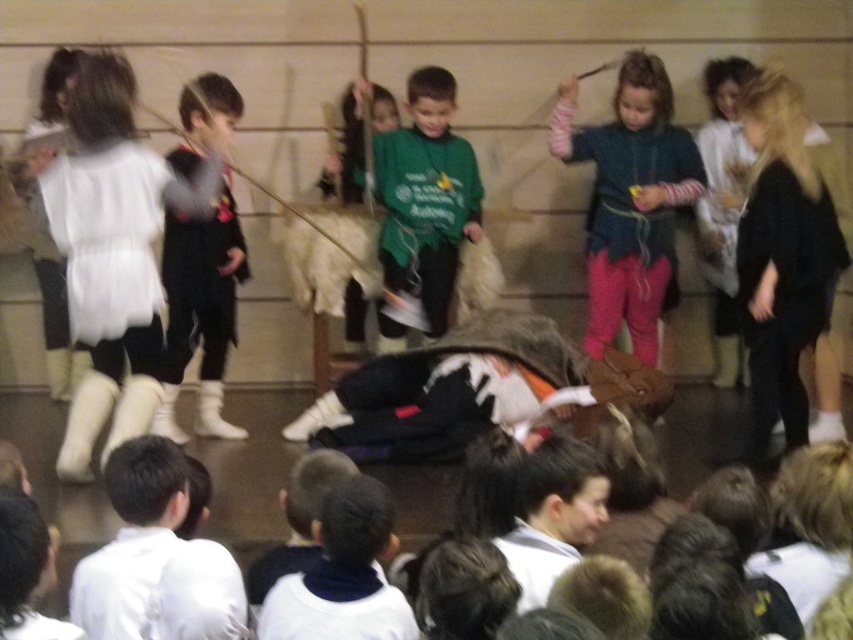
Question: Among these objects, which one is nearest to the camera?

Choices:
 (A) teal sweater at center
 (B) black sweater at right

Answer: (B)

Question: Which of these objects is positioned farthest from the teal sweater at center?

Choices:
 (A) black sweater at right
 (B) green matte shirt at center
 (C) matte black vest at left

Answer: (C)

Question: Which point appears farthest from the camera in this image?

Choices:
 (A) (200, 241)
 (B) (630, 118)
 (C) (416, 179)
 (D) (778, 218)

Answer: (C)

Question: Is teal sweater at center bigger than matte black vest at left?

Choices:
 (A) no
 (B) yes

Answer: (B)

Question: Is green matte shirt at center bigger than matte black vest at left?

Choices:
 (A) no
 (B) yes

Answer: (B)

Question: Does black sweater at right lie in front of teal sweater at center?

Choices:
 (A) yes
 (B) no

Answer: (A)